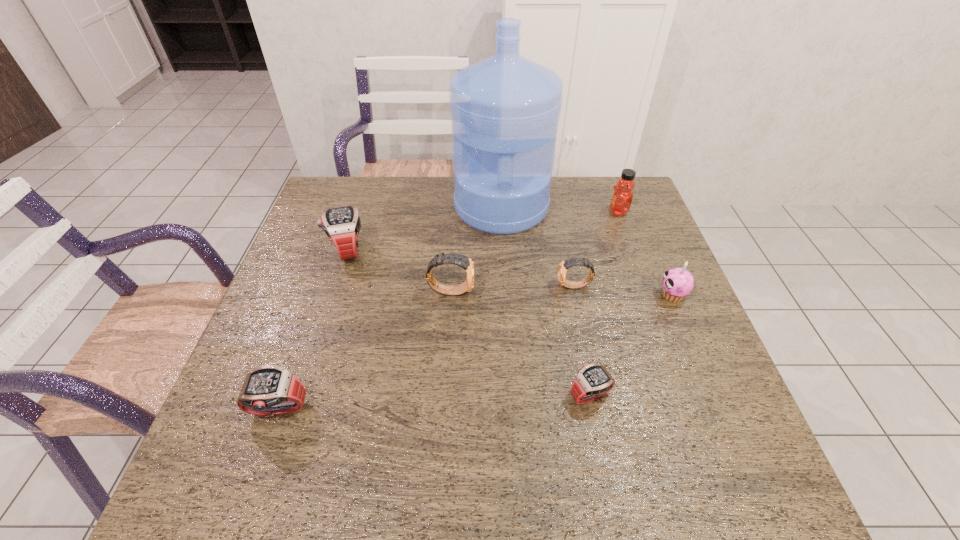
What are the coordinates of `vacant space situated on the face of the cupcake` in the screenshot? It's located at (591, 295).

Find the location of `vacant space located 0.120m on the right of the second smallest red watch`. vacant space located 0.120m on the right of the second smallest red watch is located at coordinates (368, 410).

Where is `free space located on the face of the smaller gold watch`? The image size is (960, 540). free space located on the face of the smaller gold watch is located at coordinates (426, 286).

Locate an element on the screen. This screenshot has height=540, width=960. vacant space situated 0.390m on the face of the smaller gold watch is located at coordinates (407, 286).

This screenshot has width=960, height=540. I want to click on free space located 0.080m on the face of the smaller gold watch, so click(x=526, y=286).

You are a GUI agent. You are given a task and a screenshot of the screen. Output one action in this format:
    pyautogui.click(x=<x>, y=<y>)
    Task: Click on the vacant space located 0.230m on the left of the shortest object
    
    Given the screenshot: What is the action you would take?
    pyautogui.click(x=458, y=395)

The width and height of the screenshot is (960, 540). Identify the location of water jug present at the far edge. (505, 109).

Image resolution: width=960 pixels, height=540 pixels. Identify the location of honey present at the far edge. (622, 197).

Where is `honey at the right edge`? honey at the right edge is located at coordinates (622, 197).

Where is `cupcake situated at the right edge`? cupcake situated at the right edge is located at coordinates (677, 283).